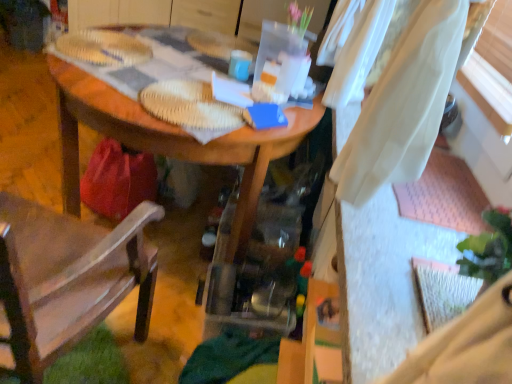
Find the location of a particular element. free space that is to the left of matte blue mug at center is located at coordinates (201, 64).